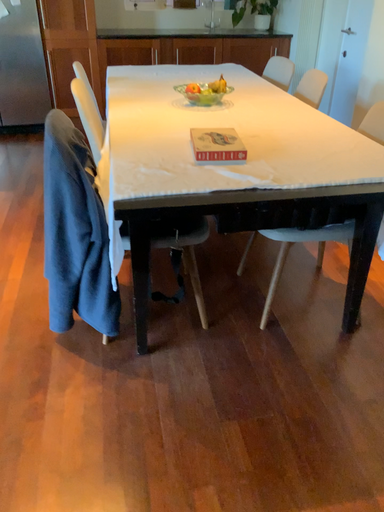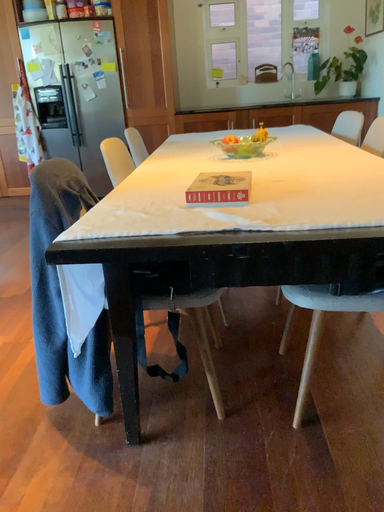
Question: How did the camera likely rotate when shooting the video?

Choices:
 (A) rotated right
 (B) rotated left

Answer: (B)